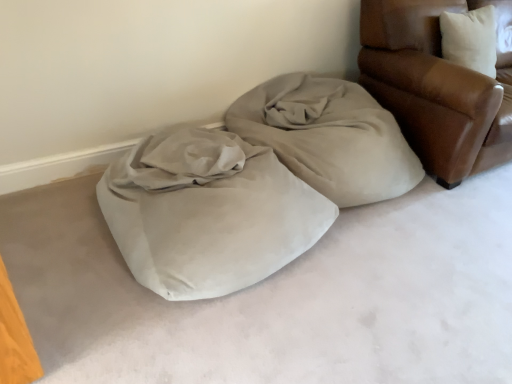
Question: From the image's perspective, is beige fabric at center above or below suede-like beige bean bag at center?

Choices:
 (A) above
 (B) below

Answer: (A)

Question: Considering the positions of beige fabric at center and suede-like beige bean bag at center in the image, is beige fabric at center bigger or smaller than suede-like beige bean bag at center?

Choices:
 (A) big
 (B) small

Answer: (B)

Question: Estimate the real-world distances between objects in this image. Which object is farther from the beige fabric at center?

Choices:
 (A) leather armchair at upper right
 (B) suede-like beige bean bag at center

Answer: (A)

Question: Considering the real-world distances, which object is farthest from the beige fabric at center?

Choices:
 (A) suede-like beige bean bag at center
 (B) leather armchair at upper right

Answer: (B)